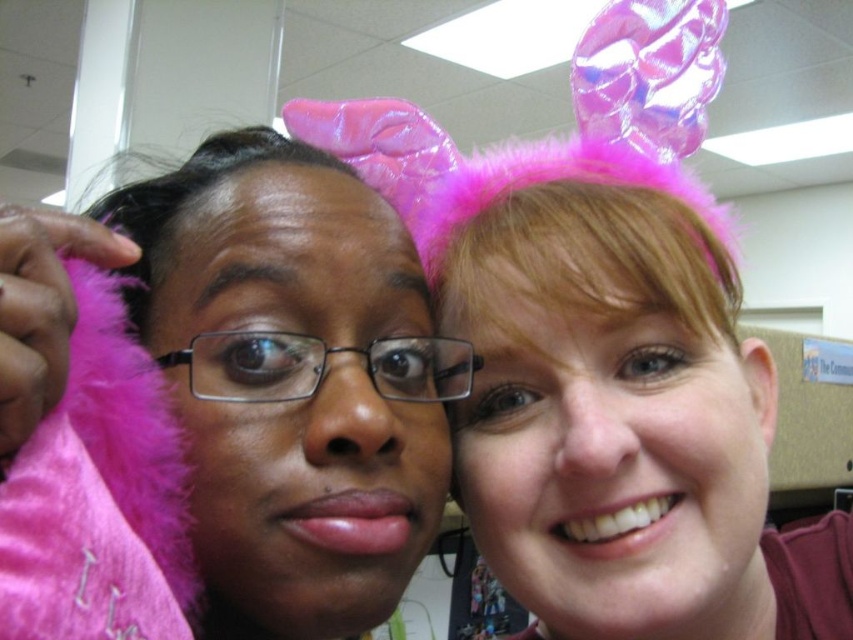
Question: Does pink fluffy headband at upper right have a lesser width compared to pink fluffy ear at upper right?

Choices:
 (A) yes
 (B) no

Answer: (B)

Question: Which object is farther from the camera taking this photo?

Choices:
 (A) pink fluffy ear at upper right
 (B) pink fluffy headband at upper right

Answer: (A)

Question: Among these objects, which one is farthest from the camera?

Choices:
 (A) pink fluffy ear at upper right
 (B) pink fluffy headband at upper right

Answer: (A)

Question: Can you confirm if pink fluffy headband at upper right is positioned below pink fluffy ear at upper right?

Choices:
 (A) no
 (B) yes

Answer: (B)

Question: Is pink fluffy headband at upper right thinner than pink fluffy ear at upper right?

Choices:
 (A) no
 (B) yes

Answer: (A)

Question: Which point is closer to the camera taking this photo?

Choices:
 (A) (488, 304)
 (B) (757, 381)

Answer: (A)